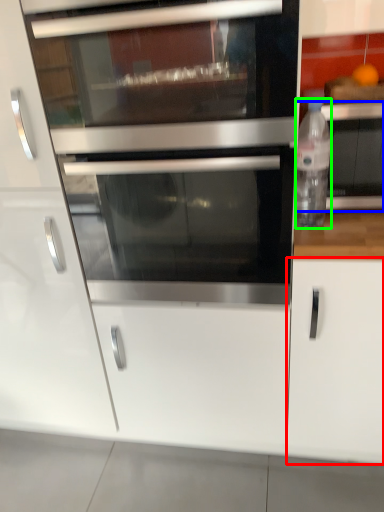
Question: Which object is positioned farthest from cabinetry (highlighted by a red box)? Select from appliance (highlighted by a blue box) and bottle (highlighted by a green box).

Choices:
 (A) appliance
 (B) bottle

Answer: (A)